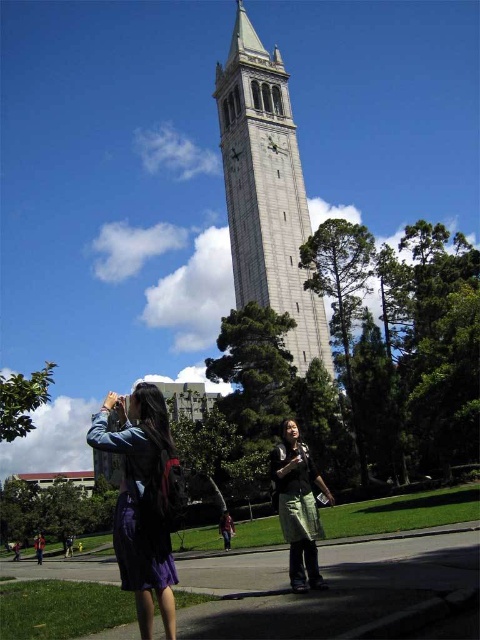
Question: Can you confirm if matte purple dress at lower left is positioned to the right of green fabric skirt at lower center?

Choices:
 (A) yes
 (B) no

Answer: (B)

Question: Is gray stone clock tower at center to the right of matte purple dress at lower left from the viewer's perspective?

Choices:
 (A) no
 (B) yes

Answer: (B)

Question: Which is nearer to the gray stone clock tower at center?

Choices:
 (A) green fabric skirt at lower center
 (B) matte purple dress at lower left

Answer: (A)

Question: Does matte purple dress at lower left appear under green fabric skirt at lower center?

Choices:
 (A) no
 (B) yes

Answer: (A)

Question: Which object is closer to the camera taking this photo?

Choices:
 (A) matte purple dress at lower left
 (B) green fabric skirt at lower center
 (C) gray stone clock tower at center

Answer: (A)

Question: Which object is positioned closest to the green fabric skirt at lower center?

Choices:
 (A) matte purple dress at lower left
 (B) gray stone clock tower at center

Answer: (A)